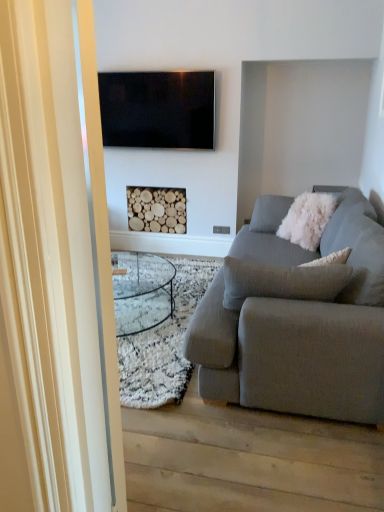
Find the location of a particular element. The width and height of the screenshot is (384, 512). blank space above wooden logs at center (from a real-world perspective) is located at coordinates (153, 187).